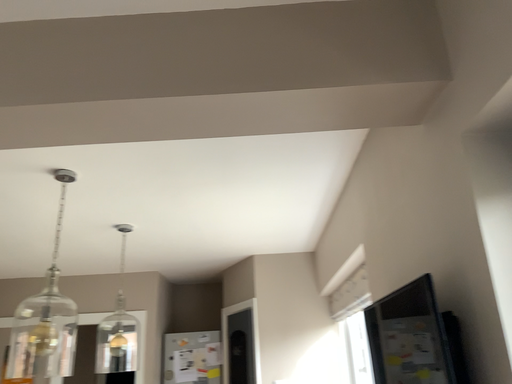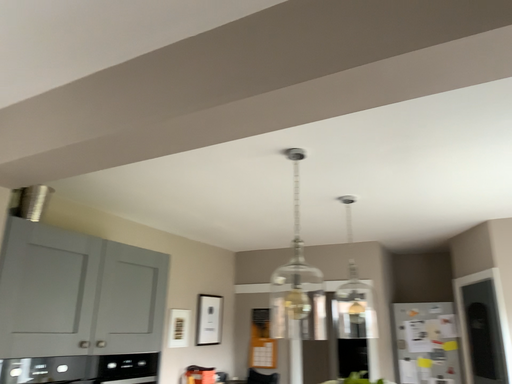
Question: Which way did the camera rotate in the video?

Choices:
 (A) rotated right
 (B) rotated left

Answer: (B)